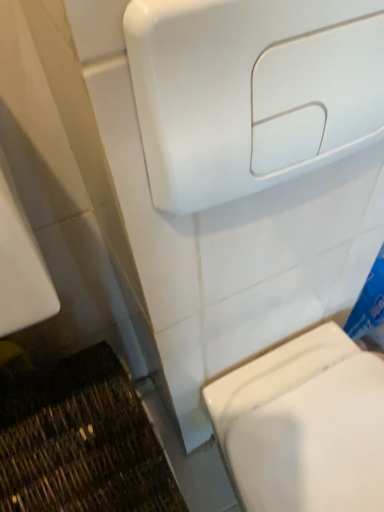
Question: Is white glossy toilet at lower right beside white glossy hand dryer at upper center?

Choices:
 (A) yes
 (B) no

Answer: (B)

Question: Is white glossy toilet at lower right further to camera compared to white glossy hand dryer at upper center?

Choices:
 (A) no
 (B) yes

Answer: (B)

Question: Considering the relative sizes of white glossy toilet at lower right and white glossy hand dryer at upper center in the image provided, is white glossy toilet at lower right smaller than white glossy hand dryer at upper center?

Choices:
 (A) yes
 (B) no

Answer: (B)

Question: Is white glossy toilet at lower right turned away from white glossy hand dryer at upper center?

Choices:
 (A) no
 (B) yes

Answer: (A)

Question: Is white glossy toilet at lower right taller than white glossy hand dryer at upper center?

Choices:
 (A) yes
 (B) no

Answer: (A)

Question: Does white glossy toilet at lower right appear on the right side of white glossy hand dryer at upper center?

Choices:
 (A) no
 (B) yes

Answer: (B)

Question: From a real-world perspective, is white glossy hand dryer at upper center positioned over white glossy toilet at lower right based on gravity?

Choices:
 (A) yes
 (B) no

Answer: (A)

Question: Is white glossy toilet at lower right at the back of white glossy hand dryer at upper center?

Choices:
 (A) yes
 (B) no

Answer: (B)

Question: Are white glossy hand dryer at upper center and white glossy toilet at lower right located far from each other?

Choices:
 (A) yes
 (B) no

Answer: (B)

Question: From the image's perspective, is white glossy hand dryer at upper center above white glossy toilet at lower right?

Choices:
 (A) yes
 (B) no

Answer: (A)

Question: Is white glossy hand dryer at upper center smaller than white glossy toilet at lower right?

Choices:
 (A) no
 (B) yes

Answer: (B)

Question: From the image's perspective, is white glossy hand dryer at upper center below white glossy toilet at lower right?

Choices:
 (A) yes
 (B) no

Answer: (B)

Question: Is point click(x=289, y=140) positioned closer to the camera than point click(x=316, y=370)?

Choices:
 (A) farther
 (B) closer

Answer: (B)